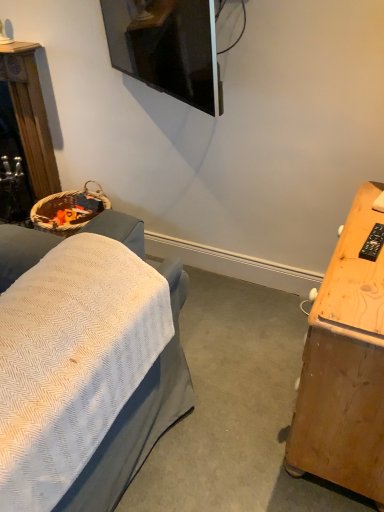
I want to click on vacant space situated on the left part of light brown wood desk at right, so click(x=230, y=403).